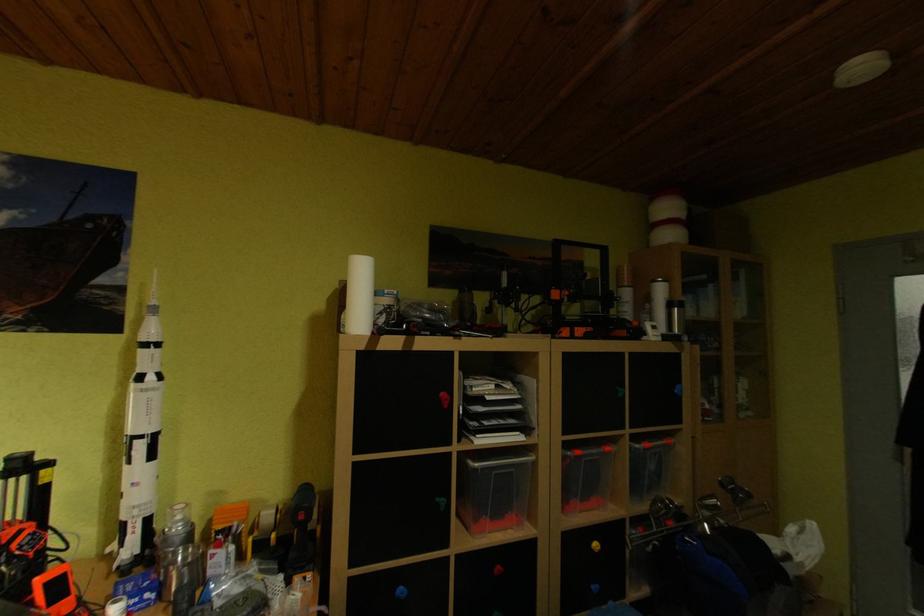
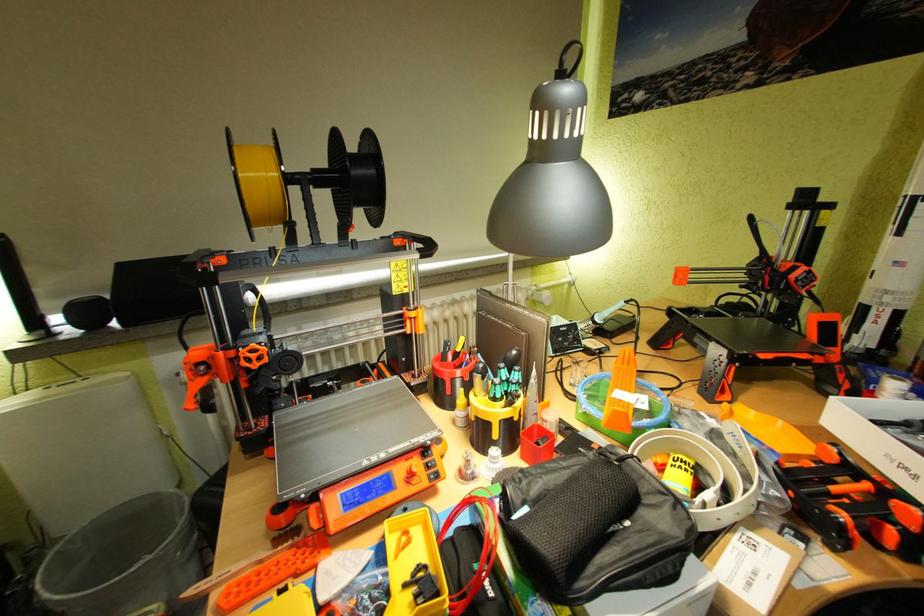
First-person continuous shooting, in which direction is the camera rotating?

The rotation direction of the camera is left-down.